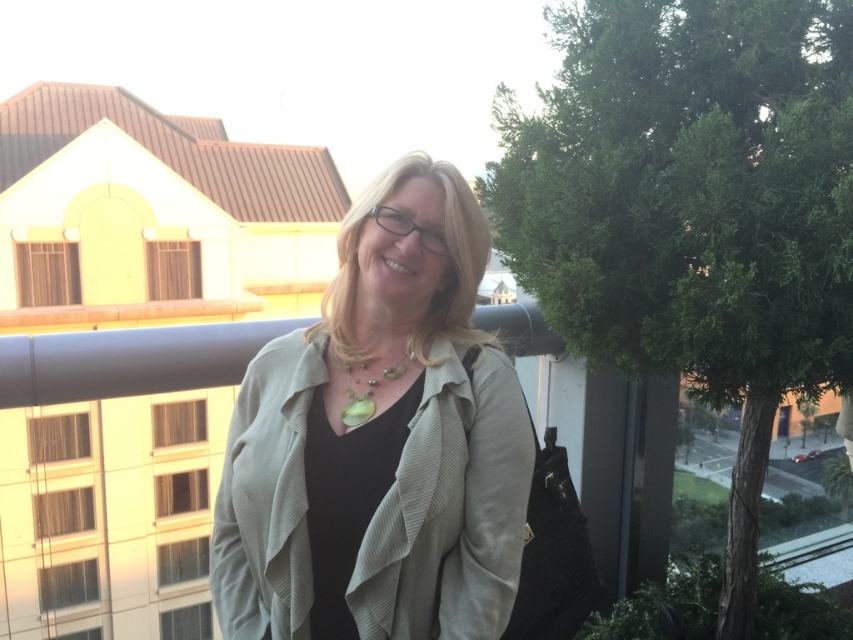
Can you confirm if matte beige jacket at center is positioned above green pearl necklace at center?

Actually, matte beige jacket at center is below green pearl necklace at center.

Does matte beige jacket at center have a larger size compared to green pearl necklace at center?

Correct, matte beige jacket at center is larger in size than green pearl necklace at center.

Is point (329, 440) positioned after point (344, 413)?

No, (329, 440) is in front of (344, 413).

The height and width of the screenshot is (640, 853). I want to click on matte beige jacket at center, so click(x=379, y=442).

Between green leafy tree at right and matte beige jacket at center, which one is positioned higher?

green leafy tree at right is higher up.

Is green leafy tree at right to the right of matte beige jacket at center from the viewer's perspective?

Correct, you'll find green leafy tree at right to the right of matte beige jacket at center.

Who is more forward, [602,337] or [425,584]?

Point [425,584] is in front.

Identify the location of green leafy tree at right. pos(692,211).

Looking at this image, does green leafy tree at right have a lesser width compared to green pearl necklace at center?

In fact, green leafy tree at right might be wider than green pearl necklace at center.

Between point (593, 49) and point (358, 362), which one is positioned behind?

The point (593, 49) is more distant.

This screenshot has width=853, height=640. Identify the location of green leafy tree at right. (692, 211).